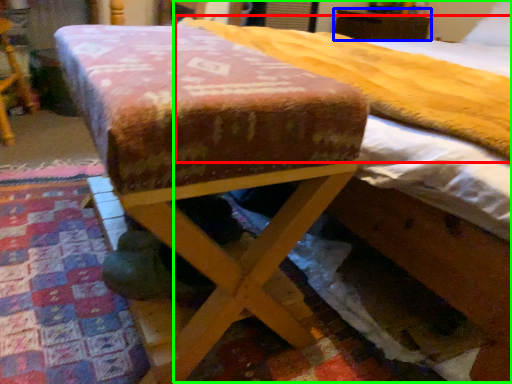
Question: Considering the real-world distances, which object is closest to mattress (highlighted by a red box)? furniture (highlighted by a blue box) or bed (highlighted by a green box).

Choices:
 (A) furniture
 (B) bed

Answer: (B)